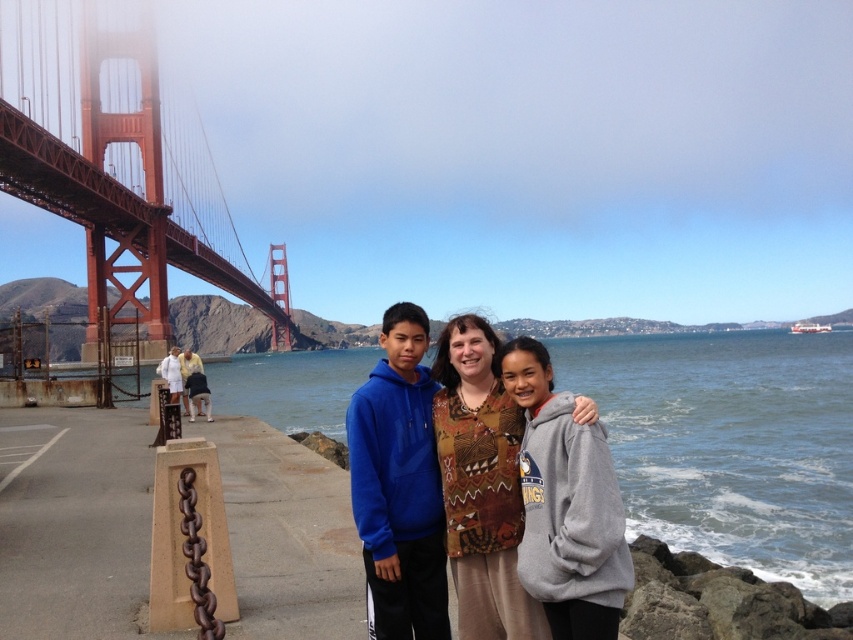
You are a photographer trying to capture the Golden Gate Bridge in the background while ensuring the white cotton shirt at left is visible. Since the red painted steel golden gate bridge at left is blocking the view, can you adjust your position to see both the bridge and the shirt?

The white cotton shirt at left is behind the red painted steel golden gate bridge at left, so moving to the side might allow you to see both the bridge and the shirt without one blocking the other.

You are a photographer planning to take a group photo of the brown textured blouse at center and the white cotton shirt at left. Based on their sizes in the image, which one should you position closer to the camera to make them appear the same size in the photo?

The brown textured blouse at center occupies less space than the white cotton shirt at left, so you should position the brown textured blouse at center closer to the camera to make them appear the same size in the photo.

You are standing at the point marked by the coordinates point (115, 163). Looking towards the golden gate bridge at left, which direction should you face to see the golden gate bridge at left?

The red painted steel golden gate bridge at left is represented by point (115, 163), so you are already facing the golden gate bridge at left.